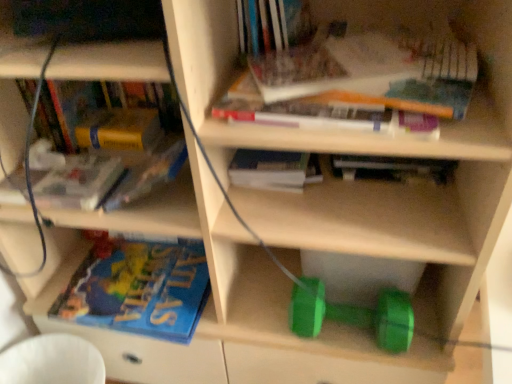
Question: Does hardcover book at upper center, placed as the 7th book when sorted from bottom to top, have a smaller size compared to yellow matte paperback book at upper left?

Choices:
 (A) yes
 (B) no

Answer: (B)

Question: Is hardcover book at upper center, placed as the 1th book when sorted from top to bottom, facing away from yellow matte paperback book at upper left?

Choices:
 (A) no
 (B) yes

Answer: (A)

Question: Can you confirm if hardcover book at upper center, placed as the 7th book when sorted from bottom to top, is wider than yellow matte paperback book at upper left?

Choices:
 (A) no
 (B) yes

Answer: (B)

Question: From a real-world perspective, is hardcover book at upper center, placed as the 1th book when sorted from top to bottom, over yellow matte paperback book at upper left?

Choices:
 (A) yes
 (B) no

Answer: (A)

Question: Is the depth of hardcover book at upper center, placed as the 7th book when sorted from bottom to top, greater than that of yellow matte paperback book at upper left?

Choices:
 (A) no
 (B) yes

Answer: (A)

Question: Which is correct: hardcover book at upper center, the fourth book viewed from the top, is inside hardcover book at center, which ranks as the third book in top-to-bottom order, or outside of it?

Choices:
 (A) outside
 (B) inside

Answer: (A)

Question: From the image's perspective, relative to hardcover book at center, which is counted as the 5th book, starting from the bottom, is hardcover book at upper center, the 4th book positioned from the bottom, above or below?

Choices:
 (A) above
 (B) below

Answer: (B)

Question: Considering the positions of point pyautogui.click(x=393, y=165) and point pyautogui.click(x=263, y=178), is point pyautogui.click(x=393, y=165) closer or farther from the camera than point pyautogui.click(x=263, y=178)?

Choices:
 (A) farther
 (B) closer

Answer: (A)

Question: From their relative heights in the image, would you say hardcover book at upper center, the 4th book positioned from the bottom, is taller or shorter than hardcover book at center, which ranks as the third book in top-to-bottom order?

Choices:
 (A) tall
 (B) short

Answer: (A)

Question: From a real-world perspective, is yellow matte paperback book at upper left positioned above or below yellow matte book at upper left, acting as the fifth book starting from the top?

Choices:
 (A) above
 (B) below

Answer: (B)

Question: From the image's perspective, is yellow matte paperback book at upper left located above or below yellow matte book at upper left, acting as the fifth book starting from the top?

Choices:
 (A) below
 (B) above

Answer: (B)

Question: Visually, is yellow matte paperback book at upper left positioned to the left or to the right of yellow matte book at upper left, which is the third book in bottom-to-top order?

Choices:
 (A) left
 (B) right

Answer: (A)

Question: Considering the positions of yellow matte paperback book at upper left and yellow matte book at upper left, acting as the fifth book starting from the top, in the image, is yellow matte paperback book at upper left bigger or smaller than yellow matte book at upper left, acting as the fifth book starting from the top,?

Choices:
 (A) big
 (B) small

Answer: (B)

Question: Based on their positions, is blue matte book at lower left, placed as the first book when sorted from bottom to top, located to the left or right of green rubber dumbbell at lower center?

Choices:
 (A) right
 (B) left

Answer: (B)

Question: Do you think blue matte book at lower left, placed as the first book when sorted from bottom to top, is within green rubber dumbbell at lower center, or outside of it?

Choices:
 (A) outside
 (B) inside

Answer: (A)